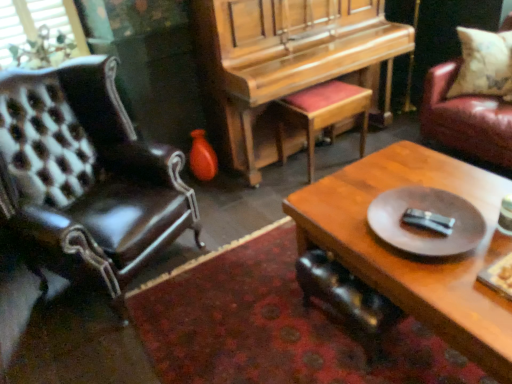
You are a GUI agent. You are given a task and a screenshot of the screen. Output one action in this format:
    pyautogui.click(x=<x>, y=<y>)
    Task: Click on the free spot in front of shiny orange vase at center
    This screenshot has width=512, height=384.
    Given the screenshot: What is the action you would take?
    pyautogui.click(x=210, y=196)